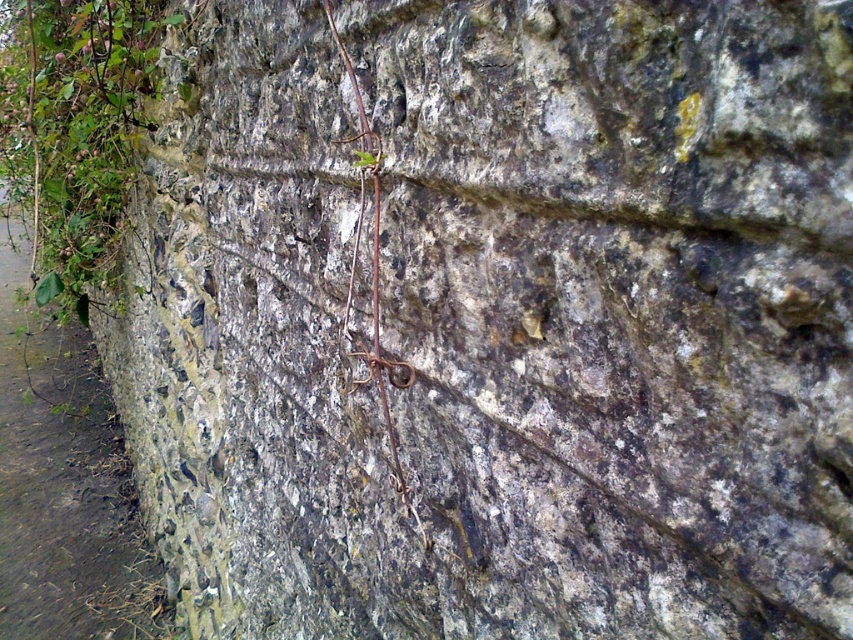
Is green mossy stone at left smaller than brown rough vine at center?

Actually, green mossy stone at left might be larger than brown rough vine at center.

Is green mossy stone at left behind brown rough vine at center?

Yes, green mossy stone at left is further from the viewer.

Which is in front, point (24, 637) or point (379, 186)?

Point (379, 186) is in front.

Where is `green mossy stone at left`? The height and width of the screenshot is (640, 853). green mossy stone at left is located at coordinates (65, 484).

Who is shorter, green leafy plant at left or brown rough vine at center?

brown rough vine at center

Is point (67, 42) more distant than point (364, 170)?

Yes, it is behind point (364, 170).

Locate an element on the screen. green leafy plant at left is located at coordinates (76, 128).

The height and width of the screenshot is (640, 853). Find the location of `green leafy plant at left`. green leafy plant at left is located at coordinates (76, 128).

Between green mossy stone at left and green leafy plant at left, which one has more height?

green leafy plant at left

At what (x,y) coordinates should I click in order to perform the action: click on green mossy stone at left. Please return your answer as a coordinate pair (x, y). The image size is (853, 640). Looking at the image, I should click on (65, 484).

Who is more distant from viewer, [119,548] or [56,291]?

The point [119,548] is more distant.

Where is `green mossy stone at left`? The image size is (853, 640). green mossy stone at left is located at coordinates (65, 484).